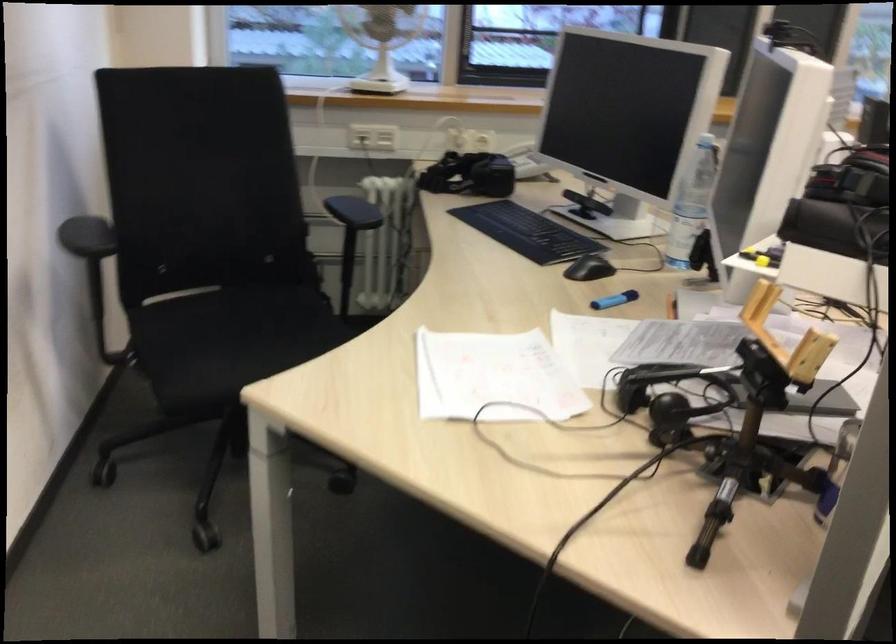
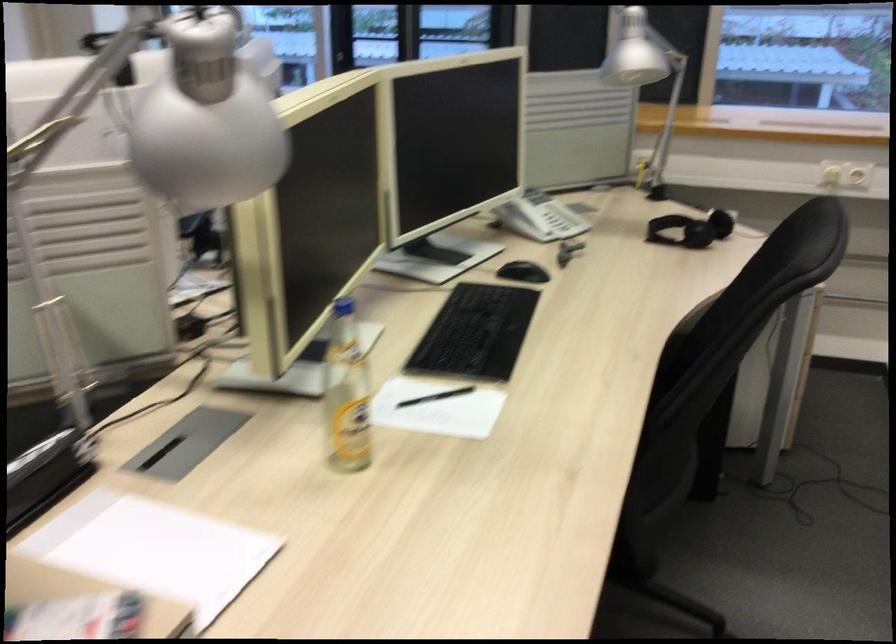
Question: The images are taken continuously from a first-person perspective. In which direction are you moving?

Choices:
 (A) Left
 (B) Right
 (C) Forward
 (D) Backward

Answer: (B)